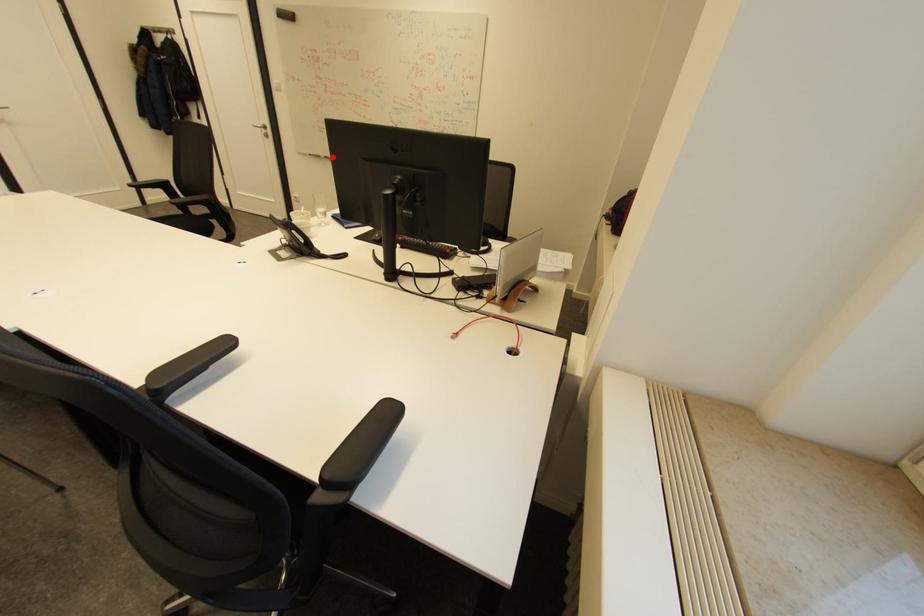
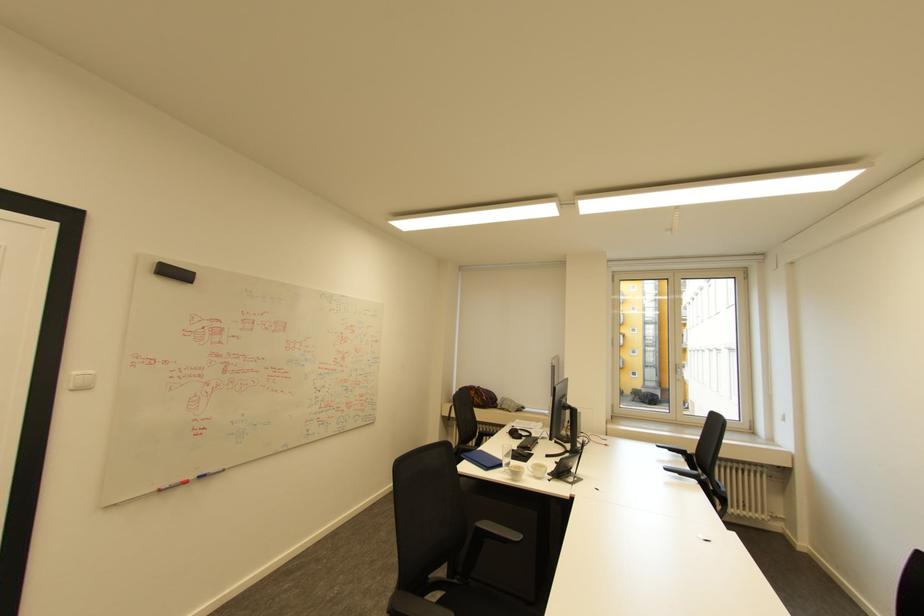
Question: I am providing you with two images of the same scene from different viewpoints. Given a red point in image1, look at the same physical point in image2. Is it:

Choices:
 (A) Closer to the viewpoint
 (B) Farther from the viewpoint

Answer: (A)